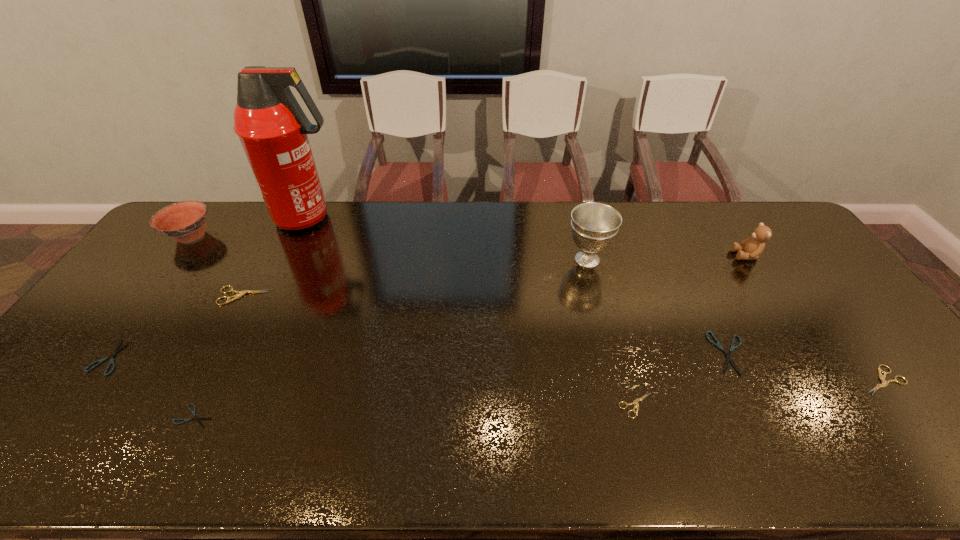
You are a GUI agent. You are given a task and a screenshot of the screen. Output one action in this format:
    pyautogui.click(x=<x>, y=<y>)
    Task: Click on the vacant position located 0.170m on the face of the teddy bear
    
    Given the screenshot: What is the action you would take?
    pyautogui.click(x=682, y=255)

Where is `vacant region located on the face of the teddy bear`? The height and width of the screenshot is (540, 960). vacant region located on the face of the teddy bear is located at coordinates (633, 255).

This screenshot has width=960, height=540. What are the coordinates of `free space located on the face of the teddy bear` in the screenshot? It's located at tap(718, 255).

Locate an element on the screen. vacant position located on the right of the bowl is located at coordinates (294, 236).

Locate an element on the screen. The image size is (960, 540). vacant space located 0.150m on the front of the farthest shears is located at coordinates (217, 347).

This screenshot has width=960, height=540. Identify the location of free location located on the back of the fifth shortest object. (818, 295).

Find the location of `vacant space located on the back of the biggest black shears`. vacant space located on the back of the biggest black shears is located at coordinates (701, 292).

Find the location of a particular element. free location located 0.160m on the right of the third shears from right to left is located at coordinates (720, 405).

At what (x,y) coordinates should I click in order to perform the action: click on free point located 0.140m on the back of the leftmost black shears. Please return your answer as a coordinate pair (x, y). Looking at the image, I should click on pos(150,301).

Locate an element on the screen. free space located 0.180m on the right of the nearest black shears is located at coordinates (291, 416).